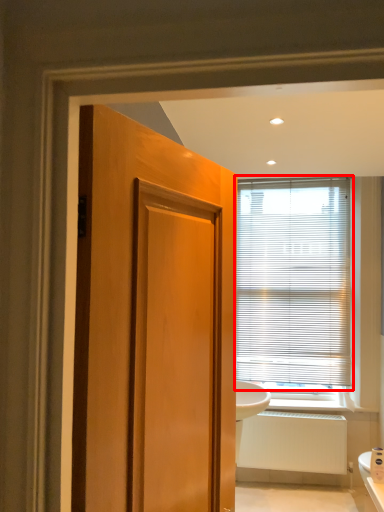
Question: Observing the image, what is the correct spatial positioning of window blind (annotated by the red box) in reference to radiator?

Choices:
 (A) right
 (B) left

Answer: (B)